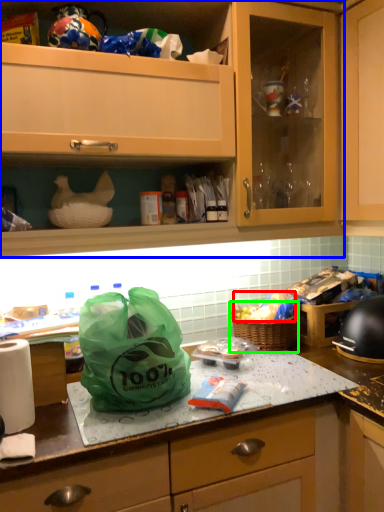
Question: Based on their relative distances, which object is nearer to food (highlighted by a red box)? Choose from cabinetry (highlighted by a blue box) and picnic basket (highlighted by a green box).

Choices:
 (A) cabinetry
 (B) picnic basket

Answer: (B)